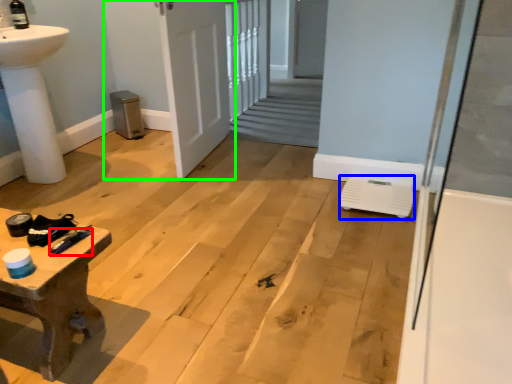
Question: Estimate the real-world distances between objects in this image. Which object is farther from tool (highlighted by a red box), water heater (highlighted by a blue box) or door (highlighted by a green box)?

Choices:
 (A) water heater
 (B) door

Answer: (B)